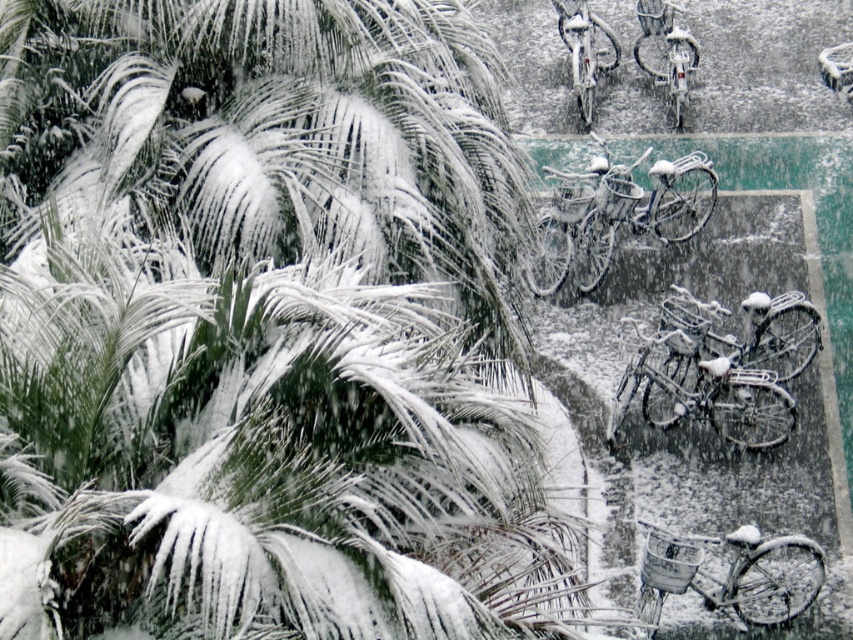
Which is below, snow-covered metallic bicycle at lower right or metallic silver bicycle at center?

snow-covered metallic bicycle at lower right is below.

This screenshot has height=640, width=853. I want to click on snow-covered metallic bicycle at lower right, so click(721, 368).

Is point (663, 380) farther from viewer compared to point (590, 104)?

No, (663, 380) is in front of (590, 104).

This screenshot has width=853, height=640. In order to click on snow-covered metallic bicycle at lower right in this screenshot , I will do `click(721, 368)`.

In the scene shown: Who is shorter, metallic silver bicycle at lower right or metallic silver bicycle at upper right?

metallic silver bicycle at lower right

Is metallic silver bicycle at lower right below metallic silver bicycle at upper right?

Yes, metallic silver bicycle at lower right is below metallic silver bicycle at upper right.

Is point (670, 561) positioned in front of point (685, 109)?

Yes, point (670, 561) is closer to viewer.

This screenshot has width=853, height=640. I want to click on metallic silver bicycle at lower right, so click(x=733, y=573).

Is snow-covered metallic bicycle at lower right positioned before metallic silver bicycle at lower right?

No, snow-covered metallic bicycle at lower right is behind metallic silver bicycle at lower right.

Between snow-covered metallic bicycle at lower right and metallic silver bicycle at lower right, which one has less height?

metallic silver bicycle at lower right is shorter.

Which is in front, point (689, 321) or point (780, 600)?

Point (780, 600) is more forward.

Locate an element on the screen. snow-covered metallic bicycle at lower right is located at coordinates (721, 368).